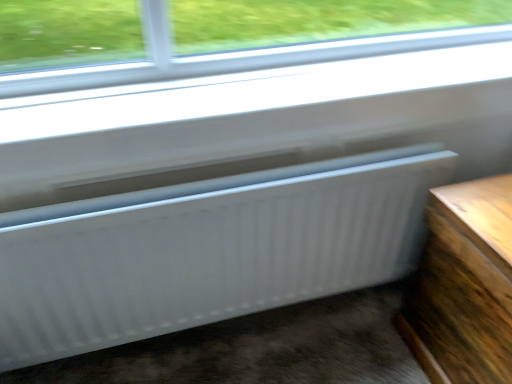
Question: From their relative heights in the image, would you say wooden table at lower right is taller or shorter than white ribbed radiator at lower center?

Choices:
 (A) tall
 (B) short

Answer: (A)

Question: In the image, is wooden table at lower right on the left side or the right side of white ribbed radiator at lower center?

Choices:
 (A) right
 (B) left

Answer: (A)

Question: From a real-world perspective, is wooden table at lower right positioned above or below white ribbed radiator at lower center?

Choices:
 (A) above
 (B) below

Answer: (B)

Question: From a real-world perspective, is white ribbed radiator at lower center physically located above or below wooden table at lower right?

Choices:
 (A) above
 (B) below

Answer: (A)

Question: Is white ribbed radiator at lower center in front of or behind wooden table at lower right in the image?

Choices:
 (A) behind
 (B) front

Answer: (A)

Question: Looking at the image, does white ribbed radiator at lower center seem bigger or smaller compared to wooden table at lower right?

Choices:
 (A) big
 (B) small

Answer: (B)

Question: From the image's perspective, is white ribbed radiator at lower center positioned above or below wooden table at lower right?

Choices:
 (A) below
 (B) above

Answer: (B)